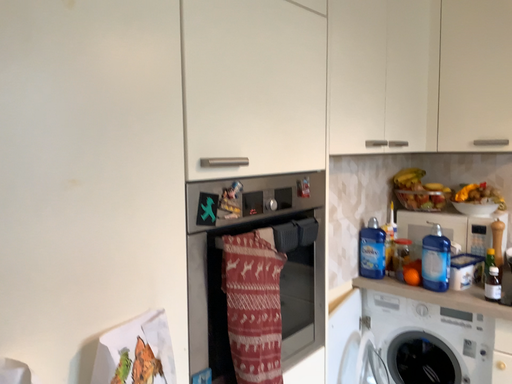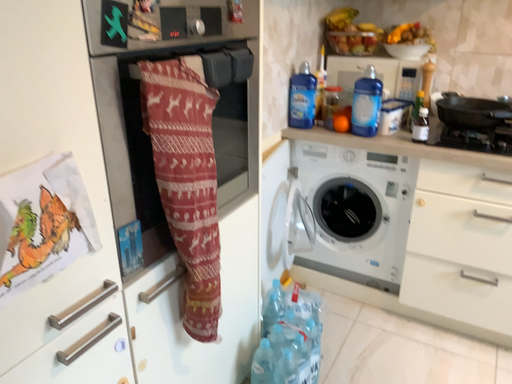
Question: How did the camera likely rotate when shooting the video?

Choices:
 (A) rotated downward
 (B) rotated upward

Answer: (A)